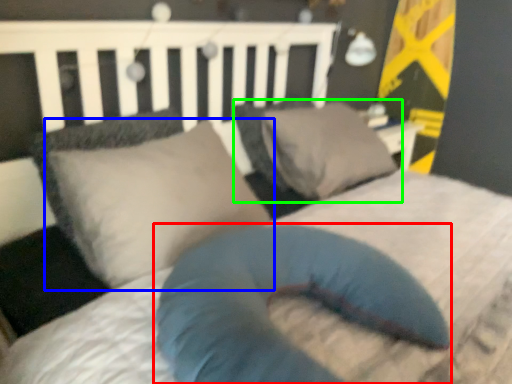
Question: Considering the real-world distances, which object is closest to pillow (highlighted by a red box)? pillow (highlighted by a blue box) or pillow (highlighted by a green box).

Choices:
 (A) pillow
 (B) pillow

Answer: (A)